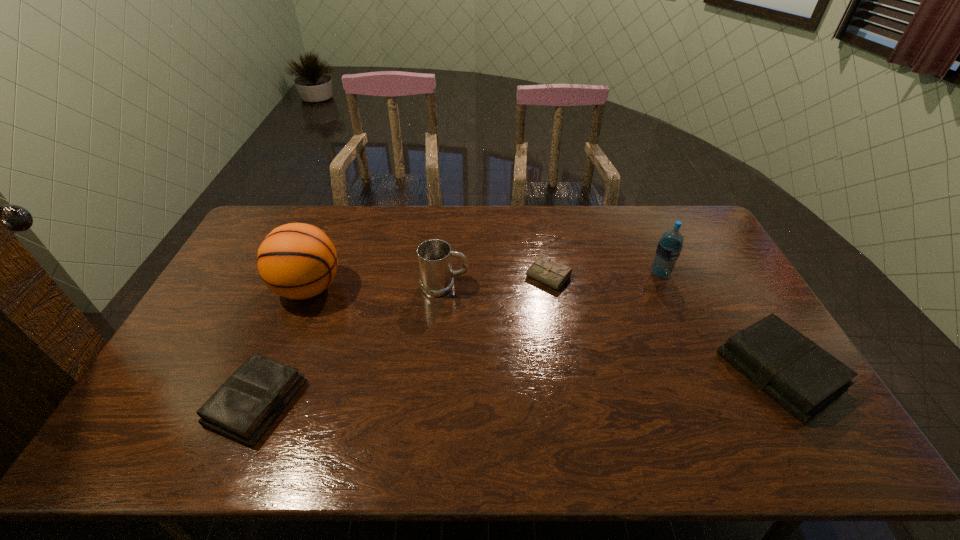
The width and height of the screenshot is (960, 540). I want to click on vacant point located 0.090m on the back of the fifth tallest object, so click(283, 336).

I want to click on free location located on the left of the taller book, so click(x=612, y=371).

Locate an element on the screen. vacant space located 0.110m on the right of the water bottle is located at coordinates (704, 274).

Locate an element on the screen. free space located 0.190m on the right of the basketball is located at coordinates tap(403, 288).

The image size is (960, 540). I want to click on vacant area situated on the front of the third object from right to left, so click(567, 391).

Image resolution: width=960 pixels, height=540 pixels. I want to click on vacant region located on the side of the mug with the handle, so click(x=565, y=286).

The height and width of the screenshot is (540, 960). In order to click on object positioned at the right edge in this screenshot , I will do `click(803, 378)`.

Where is `object located in the near right corner section of the desktop`? object located in the near right corner section of the desktop is located at coordinates (803, 378).

In order to click on free region at the far edge of the desktop in this screenshot , I will do `click(364, 237)`.

You are a GUI agent. You are given a task and a screenshot of the screen. Output one action in this format:
    pyautogui.click(x=<x>, y=<y>)
    Task: Click on the free space at the near edge of the desktop
    This screenshot has width=960, height=540.
    Given the screenshot: What is the action you would take?
    pyautogui.click(x=648, y=401)